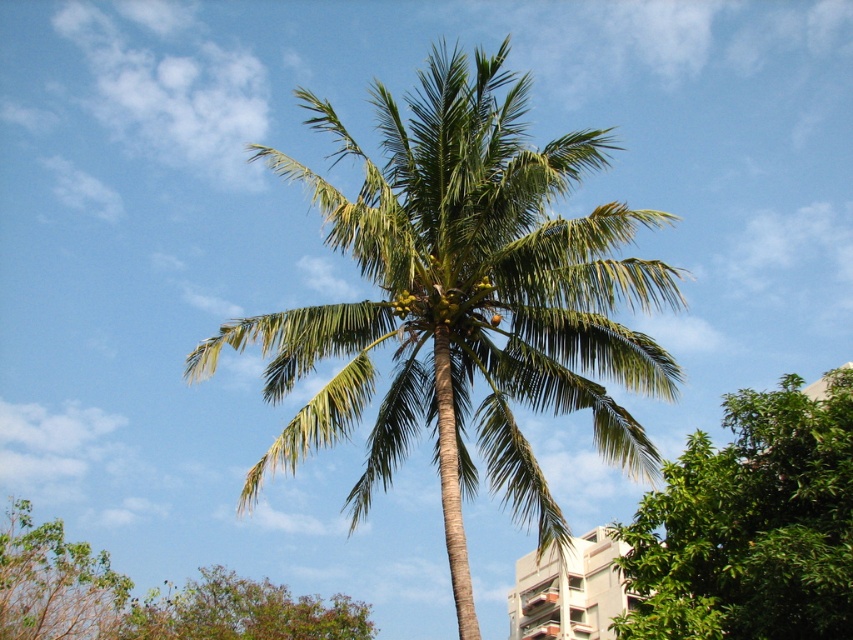
Which of these two, green leafy palm tree at center or brown leafy tree at lower left, stands shorter?

With less height is brown leafy tree at lower left.

Which is more to the left, green leafy palm tree at center or brown leafy tree at lower left?

From the viewer's perspective, brown leafy tree at lower left appears more on the left side.

Measure the distance between point (515, 444) and camera.

They are 45.19 meters apart.

Locate an element on the screen. green leafy palm tree at center is located at coordinates (463, 301).

Based on the photo, is brown leafy tree at lower left below green leafy tree at lower left?

No, brown leafy tree at lower left is not below green leafy tree at lower left.

Is brown leafy tree at lower left bigger than green leafy tree at lower left?

Correct, brown leafy tree at lower left is larger in size than green leafy tree at lower left.

The width and height of the screenshot is (853, 640). I want to click on brown leafy tree at lower left, so click(54, 582).

Where is `brown leafy tree at lower left`? The image size is (853, 640). brown leafy tree at lower left is located at coordinates (54, 582).

Is the position of green leafy tree at center less distant than that of green leafy tree at lower left?

That is True.

Is point (693, 572) positioned in front of point (228, 637)?

Yes, point (693, 572) is in front of point (228, 637).

Locate an element on the screen. The height and width of the screenshot is (640, 853). green leafy tree at center is located at coordinates (750, 525).